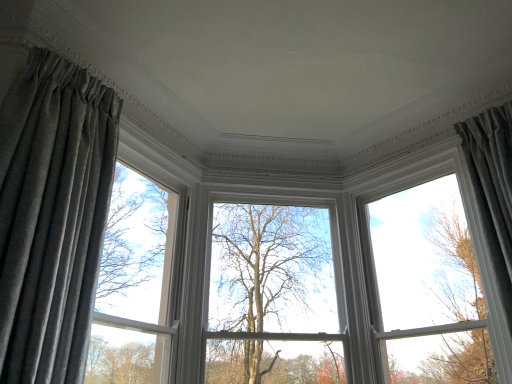
The width and height of the screenshot is (512, 384). What are the coordinates of `gray fabric curtain at right, the 2th curtain when ordered from left to right` in the screenshot? It's located at (493, 191).

Image resolution: width=512 pixels, height=384 pixels. I want to click on gray fabric curtain at right, the 2th curtain when ordered from left to right, so click(493, 191).

Which object is closer to the camera, white glossy window at upper center or matte gray curtain at left?

matte gray curtain at left.

Would you say white glossy window at upper center is inside or outside matte gray curtain at left?

white glossy window at upper center cannot be found inside matte gray curtain at left.

Looking at their sizes, would you say white glossy window at upper center is wider or thinner than matte gray curtain at left?

white glossy window at upper center is thinner than matte gray curtain at left.

Which is closer to the camera, (x=393, y=295) or (x=162, y=221)?

The point (x=393, y=295) is closer.

Between gray fabric curtain at right, the 2th curtain when ordered from left to right, and velvet gray curtain at left, which is counted as the 2th curtain, starting from the right, which one has more height?

velvet gray curtain at left, which is counted as the 2th curtain, starting from the right.

Is gray fabric curtain at right, the 2th curtain when ordered from left to right, closer to camera compared to velvet gray curtain at left, the first curtain positioned from the left?

No, gray fabric curtain at right, the 2th curtain when ordered from left to right, is further to the viewer.

Does gray fabric curtain at right, the 2th curtain when ordered from left to right, have a larger size compared to velvet gray curtain at left, which is counted as the 2th curtain, starting from the right?

Incorrect, gray fabric curtain at right, the 2th curtain when ordered from left to right, is not larger than velvet gray curtain at left, which is counted as the 2th curtain, starting from the right.

Are gray fabric curtain at right, placed as the first curtain when sorted from right to left, and velvet gray curtain at left, the first curtain positioned from the left, beside each other?

They are not placed beside each other.

Do you think velvet gray curtain at left, which is counted as the 2th curtain, starting from the right, is within gray fabric curtain at right, placed as the first curtain when sorted from right to left, or outside of it?

velvet gray curtain at left, which is counted as the 2th curtain, starting from the right, is located beyond the bounds of gray fabric curtain at right, placed as the first curtain when sorted from right to left.

In order to click on curtain located underneath the velvet gray curtain at left, which is counted as the 2th curtain, starting from the right (from a real-world perspective) in this screenshot , I will do `click(493, 191)`.

Is velvet gray curtain at left, the first curtain positioned from the left, looking in the opposite direction of gray fabric curtain at right, the 2th curtain when ordered from left to right?

velvet gray curtain at left, the first curtain positioned from the left, does not have its back to gray fabric curtain at right, the 2th curtain when ordered from left to right.

Does velvet gray curtain at left, the first curtain positioned from the left, appear on the left side of gray fabric curtain at right, placed as the first curtain when sorted from right to left?

Yes.

Could you tell me if velvet gray curtain at left, which is counted as the 2th curtain, starting from the right, is turned towards white glossy window at upper center?

No.

From a real-world perspective, is velvet gray curtain at left, which is counted as the 2th curtain, starting from the right, under white glossy window at upper center?

Yes, from a real-world perspective, velvet gray curtain at left, which is counted as the 2th curtain, starting from the right, is under white glossy window at upper center.

Is velvet gray curtain at left, which is counted as the 2th curtain, starting from the right, at the right side of white glossy window at upper center?

No.

From the image's perspective, is velvet gray curtain at left, which is counted as the 2th curtain, starting from the right, under matte gray curtain at left?

No, from the image's perspective, velvet gray curtain at left, which is counted as the 2th curtain, starting from the right, is not below matte gray curtain at left.

Is velvet gray curtain at left, the first curtain positioned from the left, taller than matte gray curtain at left?

Yes.

Is velvet gray curtain at left, which is counted as the 2th curtain, starting from the right, spatially inside matte gray curtain at left, or outside of it?

velvet gray curtain at left, which is counted as the 2th curtain, starting from the right, is not enclosed by matte gray curtain at left.

Considering the sizes of white glossy window at upper center and gray fabric curtain at right, placed as the first curtain when sorted from right to left, in the image, is white glossy window at upper center taller or shorter than gray fabric curtain at right, placed as the first curtain when sorted from right to left,?

white glossy window at upper center is taller than gray fabric curtain at right, placed as the first curtain when sorted from right to left.

Could you measure the distance between white glossy window at upper center and gray fabric curtain at right, the 2th curtain when ordered from left to right?

white glossy window at upper center and gray fabric curtain at right, the 2th curtain when ordered from left to right, are 19.25 inches apart from each other.

Looking at this image, is white glossy window at upper center positioned in front of gray fabric curtain at right, placed as the first curtain when sorted from right to left?

That is False.

From a real-world perspective, is white glossy window at upper center on gray fabric curtain at right, the 2th curtain when ordered from left to right?

Yes.

Is matte gray curtain at left not close to white glossy window at upper center?

matte gray curtain at left is far away from white glossy window at upper center.

Is matte gray curtain at left facing towards white glossy window at upper center?

No, matte gray curtain at left is not turned towards white glossy window at upper center.

From the image's perspective, which is below, matte gray curtain at left or white glossy window at upper center?

white glossy window at upper center is shown below in the image.

In the image, there is a matte gray curtain at left. At what (x,y) coordinates should I click in order to perform the action: click on bay window below it (from a real-world perspective). Please return your answer as a coordinate pair (x, y). Looking at the image, I should click on (426, 263).

I want to click on curtain above the gray fabric curtain at right, placed as the first curtain when sorted from right to left (from a real-world perspective), so click(52, 216).

Based on their spatial positions, is velvet gray curtain at left, the first curtain positioned from the left, or gray fabric curtain at right, the 2th curtain when ordered from left to right, closer to white glossy window at upper center?

gray fabric curtain at right, the 2th curtain when ordered from left to right, lies closer to white glossy window at upper center than the other object.

When comparing their distances from white glossy window at upper center, does matte gray curtain at left or velvet gray curtain at left, which is counted as the 2th curtain, starting from the right, seem closer?

Among the two, matte gray curtain at left is located nearer to white glossy window at upper center.

Looking at the image, which one is located closer to white glossy window at upper center, matte gray curtain at left or gray fabric curtain at right, placed as the first curtain when sorted from right to left?

gray fabric curtain at right, placed as the first curtain when sorted from right to left, is closer to white glossy window at upper center.

Estimate the real-world distances between objects in this image. Which object is further from matte gray curtain at left, gray fabric curtain at right, placed as the first curtain when sorted from right to left, or white glossy window at upper center?

gray fabric curtain at right, placed as the first curtain when sorted from right to left, lies further to matte gray curtain at left than the other object.

From the image, which object appears to be nearer to gray fabric curtain at right, the 2th curtain when ordered from left to right, matte gray curtain at left or white glossy window at upper center?

white glossy window at upper center is positioned closer to the anchor gray fabric curtain at right, the 2th curtain when ordered from left to right.

Considering their positions, is white glossy window at upper center positioned closer to velvet gray curtain at left, the first curtain positioned from the left, than matte gray curtain at left?

The object closer to velvet gray curtain at left, the first curtain positioned from the left, is matte gray curtain at left.

When comparing their distances from gray fabric curtain at right, the 2th curtain when ordered from left to right, does white glossy window at upper center or matte gray curtain at left seem further?

The object further to gray fabric curtain at right, the 2th curtain when ordered from left to right, is matte gray curtain at left.

Estimate the real-world distances between objects in this image. Which object is closer to velvet gray curtain at left, which is counted as the 2th curtain, starting from the right, white glossy window at upper center or gray fabric curtain at right, placed as the first curtain when sorted from right to left?

white glossy window at upper center is closer to velvet gray curtain at left, which is counted as the 2th curtain, starting from the right.

The image size is (512, 384). In order to click on window between velvet gray curtain at left, which is counted as the 2th curtain, starting from the right, and white glossy window at upper center, in the horizontal direction in this screenshot , I will do `click(139, 281)`.

Locate an element on the screen. bay window between matte gray curtain at left and gray fabric curtain at right, placed as the first curtain when sorted from right to left, from left to right is located at coordinates (426, 263).

Where is `bay window between velvet gray curtain at left, the first curtain positioned from the left, and gray fabric curtain at right, the 2th curtain when ordered from left to right`? The width and height of the screenshot is (512, 384). bay window between velvet gray curtain at left, the first curtain positioned from the left, and gray fabric curtain at right, the 2th curtain when ordered from left to right is located at coordinates (426, 263).

At what (x,y) coordinates should I click in order to perform the action: click on window between velvet gray curtain at left, which is counted as the 2th curtain, starting from the right, and gray fabric curtain at right, the 2th curtain when ordered from left to right, in the horizontal direction. Please return your answer as a coordinate pair (x, y). Looking at the image, I should click on (139, 281).